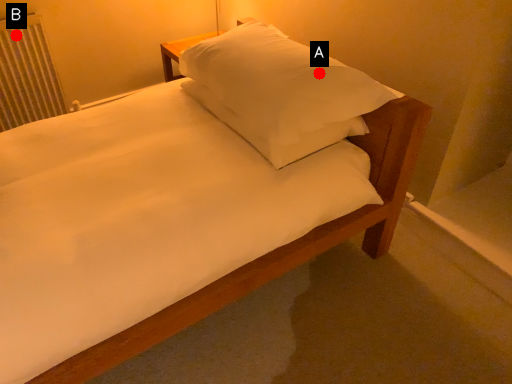
Question: Two points are circled on the image, labeled by A and B beside each circle. Which point is closer to the camera?

Choices:
 (A) A is closer
 (B) B is closer

Answer: (A)